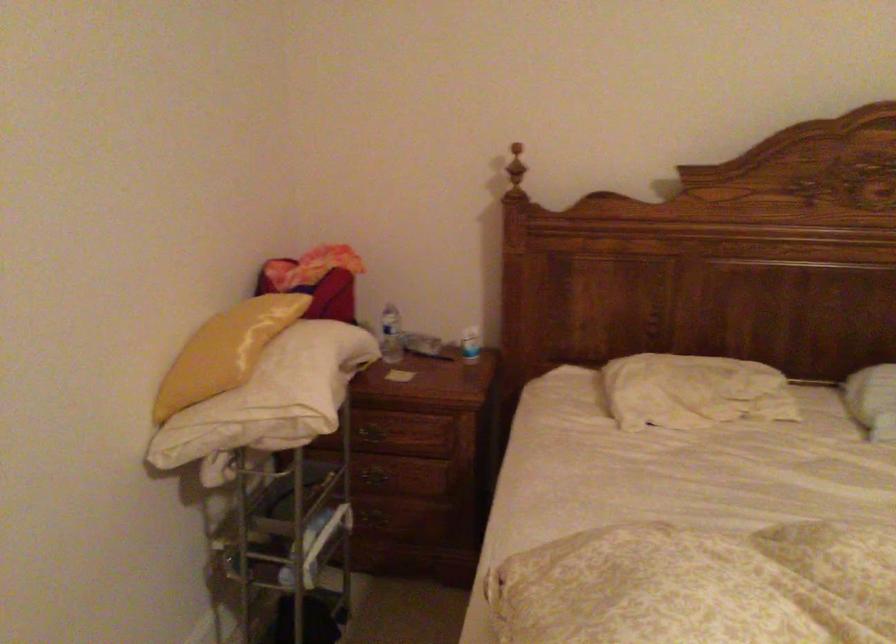
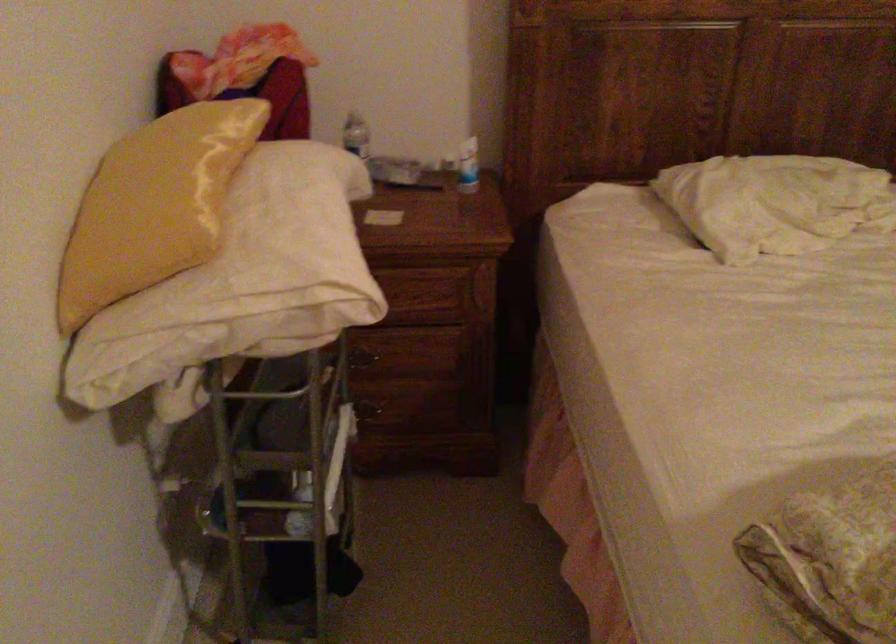
Where in the second image is the point corresponding to pixel 263 395 from the first image?

(254, 272)